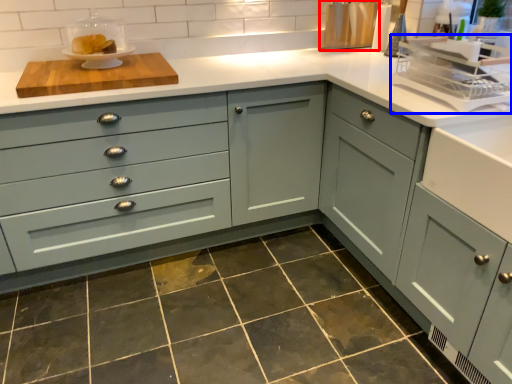
Question: Which object is closer to the camera taking this photo, appliance (highlighted by a red box) or appliance (highlighted by a blue box)?

Choices:
 (A) appliance
 (B) appliance

Answer: (B)